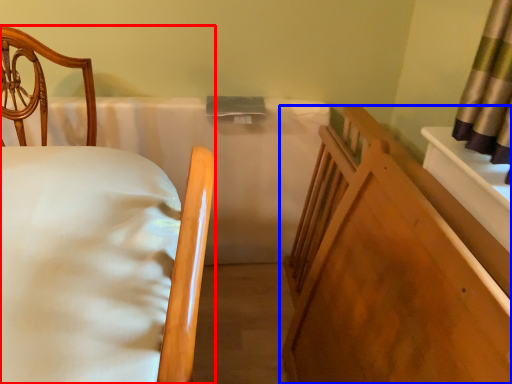
Question: Which object is further to the camera taking this photo, bed (highlighted by a red box) or furniture (highlighted by a blue box)?

Choices:
 (A) bed
 (B) furniture

Answer: (B)